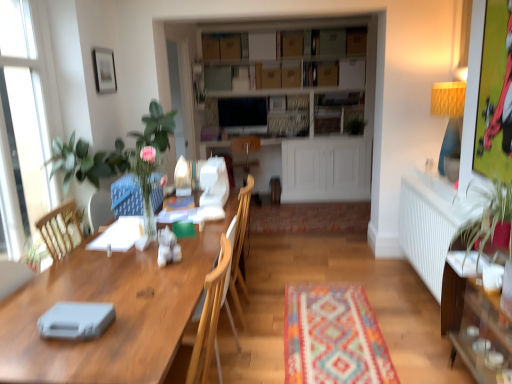
Where is `free space to the right of wooden armchair at center`? This screenshot has width=512, height=384. free space to the right of wooden armchair at center is located at coordinates (271, 307).